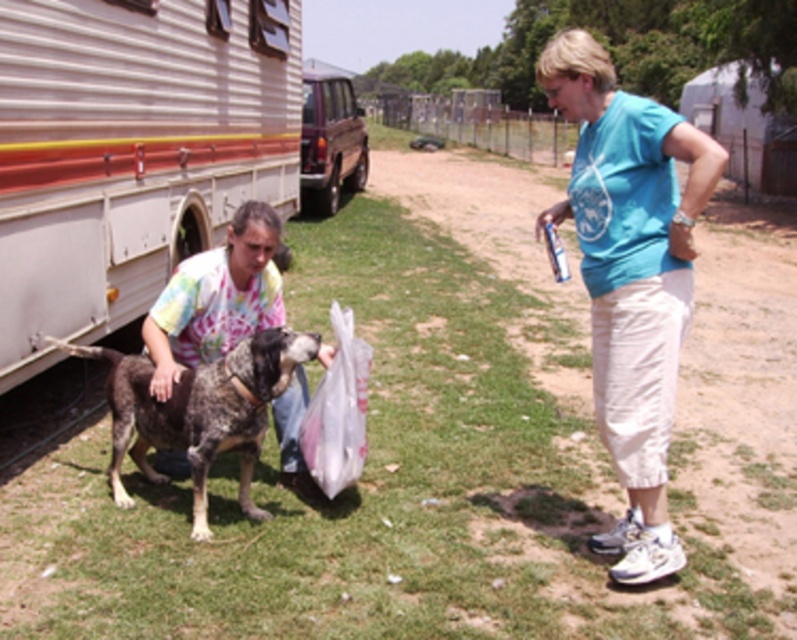
Question: Can you confirm if blue cotton shirt at upper right is positioned above tie-dye fabric shirt at lower left?

Choices:
 (A) yes
 (B) no

Answer: (A)

Question: Does spotted fur dog at center have a greater width compared to metallic brown van at upper left?

Choices:
 (A) no
 (B) yes

Answer: (B)

Question: Among these objects, which one is nearest to the camera?

Choices:
 (A) blue cotton shirt at upper right
 (B) metallic brown van at upper left
 (C) tie-dye fabric shirt at lower left

Answer: (A)

Question: Which of the following is the closest to the observer?

Choices:
 (A) spotted fur dog at center
 (B) tie-dye fabric shirt at lower left

Answer: (A)

Question: Estimate the real-world distances between objects in this image. Which object is closer to the blue cotton shirt at upper right?

Choices:
 (A) spotted fur dog at center
 (B) metallic brown van at upper left

Answer: (A)

Question: Is blue cotton shirt at upper right closer to camera compared to tie-dye fabric shirt at lower left?

Choices:
 (A) yes
 (B) no

Answer: (A)